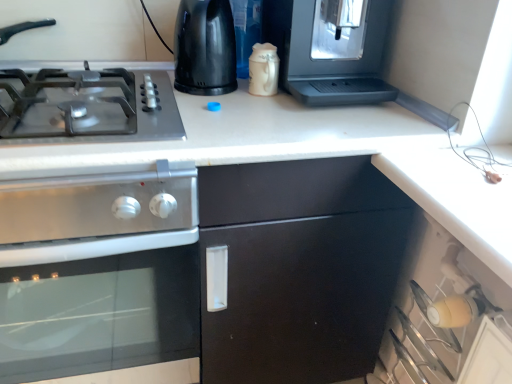
Identify the location of unoccupied area in front of satin silver coffee machine at upper right, which is counted as the 2th appliance, starting from the left. (292, 123).